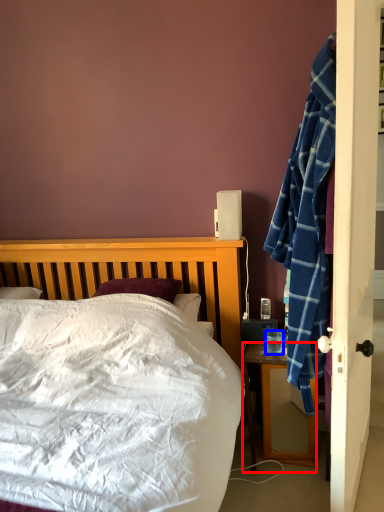
Question: Which point is further to the camera, desk (highlighted by a red box) or coffee cup (highlighted by a blue box)?

Choices:
 (A) desk
 (B) coffee cup

Answer: (B)